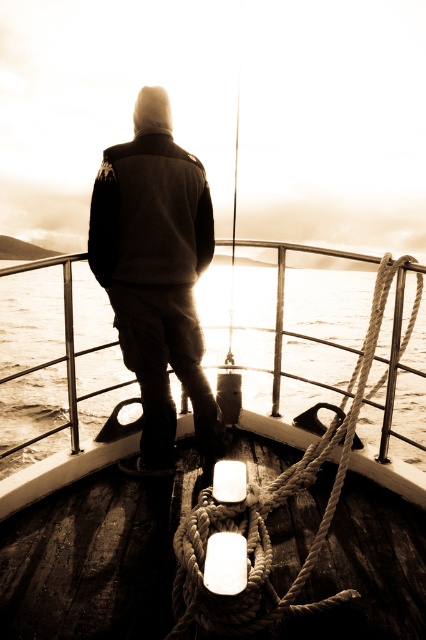
Is translucent water at center to the right of rope at center from the viewer's perspective?

Incorrect, translucent water at center is not on the right side of rope at center.

Is translucent water at center above rope at center?

Yes.

Is point (411, 342) more distant than point (187, 554)?

Yes, point (411, 342) is farther from viewer.

Where is `translucent water at center`? translucent water at center is located at coordinates (31, 317).

Is dark gray hoodie at center thinner than rope at center?

Yes, dark gray hoodie at center is thinner than rope at center.

Who is positioned more to the right, dark gray hoodie at center or rope at center?

Positioned to the right is rope at center.

Who is more distant from viewer, [210,253] or [321,451]?

Positioned behind is point [210,253].

Find the location of a particular element. The height and width of the screenshot is (640, 426). dark gray hoodie at center is located at coordinates (157, 273).

Does translucent water at center have a greater height compared to dark gray hoodie at center?

Indeed, translucent water at center has a greater height compared to dark gray hoodie at center.

Who is more distant from viewer, (308, 310) or (193, 275)?

The point (308, 310) is behind.

The image size is (426, 640). What do you see at coordinates (31, 317) in the screenshot?
I see `translucent water at center` at bounding box center [31, 317].

Locate an element on the screen. The image size is (426, 640). translucent water at center is located at coordinates (31, 317).